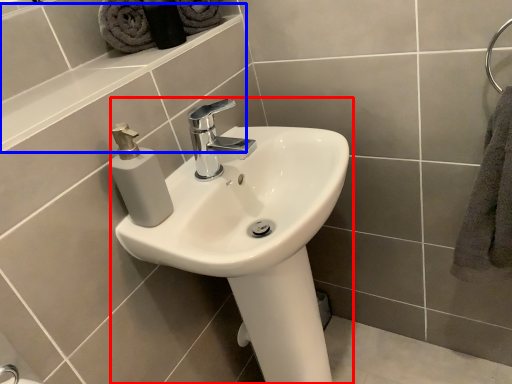
Question: Which object is further to the camera taking this photo, sink (highlighted by a red box) or ledge (highlighted by a blue box)?

Choices:
 (A) sink
 (B) ledge

Answer: (B)